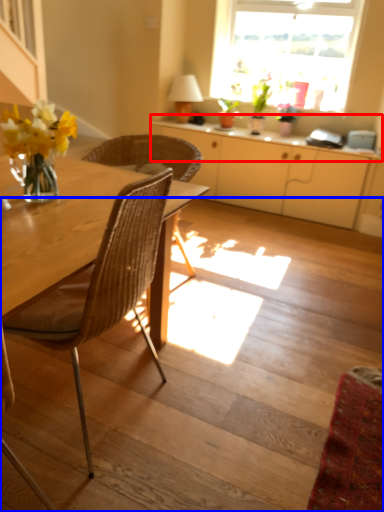
Question: Which point is closer to the camera, counter top (highlighted by a red box) or stairs (highlighted by a blue box)?

Choices:
 (A) counter top
 (B) stairs

Answer: (B)